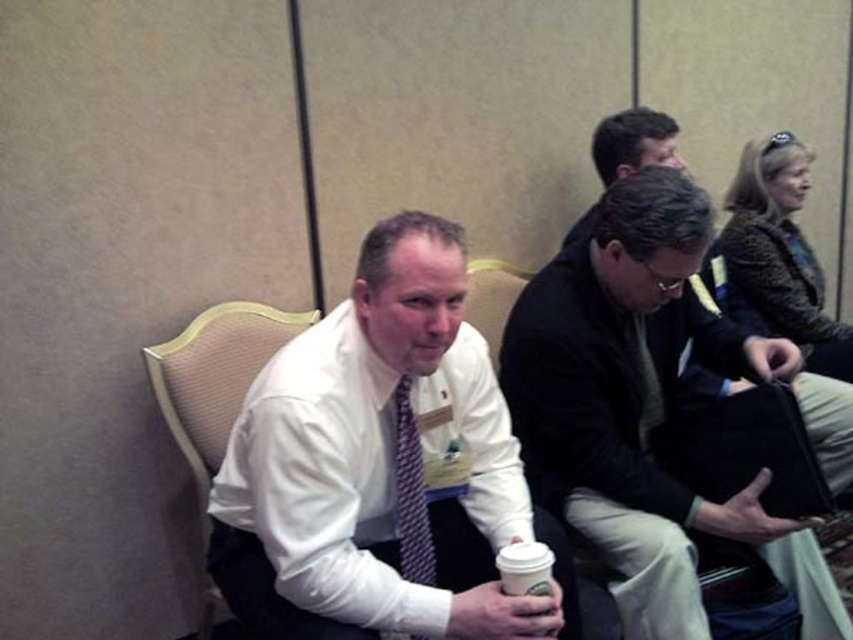
Question: Considering the real-world distances, which object is farthest from the dark gray sweater at center?

Choices:
 (A) white paper cup at lower center
 (B) dark gray jacket at center
 (C) striped fabric tie at center
 (D) beige fabric chair at left

Answer: (D)

Question: Is beige fabric chair at left behind matte black tie at center?

Choices:
 (A) no
 (B) yes

Answer: (B)

Question: Can you confirm if dark gray sweater at center is positioned below matte black tie at center?

Choices:
 (A) no
 (B) yes

Answer: (B)

Question: Which object is positioned closest to the dark gray sweater at center?

Choices:
 (A) white shirt at center
 (B) beige fabric chair at left

Answer: (A)

Question: Is dark gray sweater at center bigger than beige fabric chair at left?

Choices:
 (A) no
 (B) yes

Answer: (B)

Question: Which is farther from the dark gray sweater at center?

Choices:
 (A) matte black tie at center
 (B) white paper cup at lower center
 (C) striped fabric tie at center

Answer: (C)